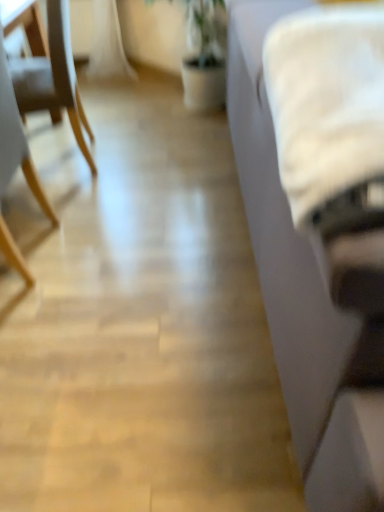
Question: Considering the relative sizes of light wood chair at left, which is the second chair from front to back, and white fabric couch at right in the image provided, is light wood chair at left, which is the second chair from front to back, shorter than white fabric couch at right?

Choices:
 (A) no
 (B) yes

Answer: (B)

Question: Is light wood chair at left, which appears as the 1th chair when viewed from the back, smaller than white fabric couch at right?

Choices:
 (A) no
 (B) yes

Answer: (B)

Question: Considering the relative positions of light wood chair at left, which is the second chair from front to back, and white fabric couch at right in the image provided, is light wood chair at left, which is the second chair from front to back, in front of white fabric couch at right?

Choices:
 (A) no
 (B) yes

Answer: (A)

Question: Can we say light wood chair at left, which is the second chair from front to back, lies outside white fabric couch at right?

Choices:
 (A) no
 (B) yes

Answer: (B)

Question: Considering the relative sizes of light wood chair at left, which is the second chair from front to back, and white fabric couch at right in the image provided, is light wood chair at left, which is the second chair from front to back, bigger than white fabric couch at right?

Choices:
 (A) no
 (B) yes

Answer: (A)

Question: Considering the positions of point (241, 11) and point (51, 106), is point (241, 11) closer or farther from the camera than point (51, 106)?

Choices:
 (A) closer
 (B) farther

Answer: (A)

Question: In the image, is white fabric couch at right on the left side or the right side of light wood chair at left, which is the second chair from front to back?

Choices:
 (A) left
 (B) right

Answer: (B)

Question: Is white fabric couch at right in front of or behind light wood chair at left, which appears as the 1th chair when viewed from the back, in the image?

Choices:
 (A) front
 (B) behind

Answer: (A)

Question: From a real-world perspective, is white fabric couch at right positioned above or below light wood chair at left, which is the second chair from front to back?

Choices:
 (A) below
 (B) above

Answer: (B)

Question: Is wooden chair at left, placed as the second chair when sorted from back to front, to the left or to the right of white fluffy blanket at right in the image?

Choices:
 (A) right
 (B) left

Answer: (B)

Question: Does point (1, 119) appear closer or farther from the camera than point (354, 134)?

Choices:
 (A) closer
 (B) farther

Answer: (B)

Question: In terms of width, does wooden chair at left, which appears as the 1th chair when viewed from the front, look wider or thinner when compared to white fluffy blanket at right?

Choices:
 (A) wide
 (B) thin

Answer: (A)

Question: Is wooden chair at left, which appears as the 1th chair when viewed from the front, inside the boundaries of white fluffy blanket at right, or outside?

Choices:
 (A) inside
 (B) outside

Answer: (B)

Question: Based on their positions, is wooden chair at left, which appears as the 1th chair when viewed from the front, located to the left or right of light wood chair at left, which is the second chair from front to back?

Choices:
 (A) right
 (B) left

Answer: (B)

Question: Considering the positions of wooden chair at left, which appears as the 1th chair when viewed from the front, and light wood chair at left, which is the second chair from front to back, in the image, is wooden chair at left, which appears as the 1th chair when viewed from the front, taller or shorter than light wood chair at left, which is the second chair from front to back,?

Choices:
 (A) tall
 (B) short

Answer: (A)